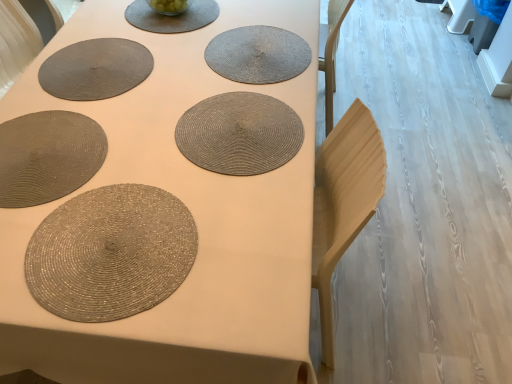
You are a GUI agent. You are given a task and a screenshot of the screen. Output one action in this format:
    pyautogui.click(x=<x>, y=<y>)
    Task: Click on the vacant space in front of matte gray placemat at upper left, arranged as the 3th paper plate when ordered from the bottom
    The image size is (512, 384).
    Given the screenshot: What is the action you would take?
    pyautogui.click(x=75, y=124)